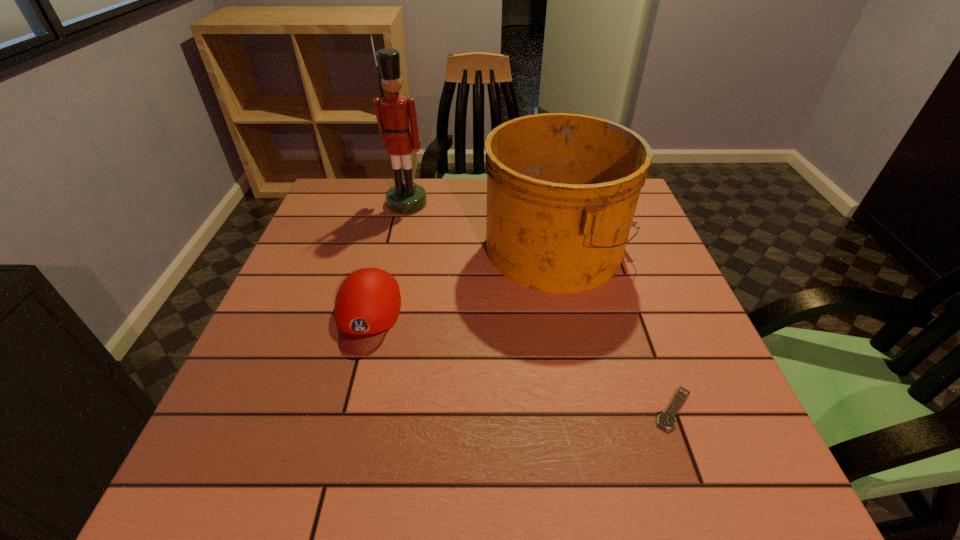
Locate an element on the screen. This screenshot has width=960, height=540. free space that satisfies the following two spatial constraints: 1. on the front-facing side of the tallest object; 2. on the left side of the third shortest object is located at coordinates (397, 247).

Where is `free location that satisfies the following two spatial constraints: 1. on the front-facing side of the bucket; 2. on the right side of the tallest object`? free location that satisfies the following two spatial constraints: 1. on the front-facing side of the bucket; 2. on the right side of the tallest object is located at coordinates (397, 247).

Find the location of a particular element. free point that satisfies the following two spatial constraints: 1. on the front-facing side of the baseball cap; 2. on the left side of the nearest object is located at coordinates (344, 409).

This screenshot has width=960, height=540. In order to click on vacant region that satisfies the following two spatial constraints: 1. on the front-facing side of the nearest object; 2. on the right side of the nutcracker in this screenshot , I will do `click(361, 409)`.

The width and height of the screenshot is (960, 540). Identify the location of vacant point that satisfies the following two spatial constraints: 1. on the front-facing side of the nearest object; 2. on the left side of the tallest object. (361, 409).

Identify the location of vacant area in the image that satisfies the following two spatial constraints: 1. on the front-facing side of the bucket; 2. on the right side of the nutcracker. (397, 247).